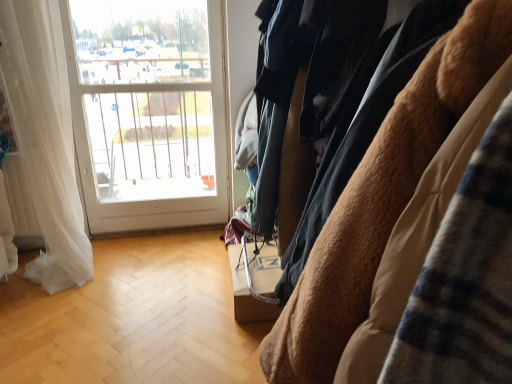
You are a GUI agent. You are given a task and a screenshot of the screen. Output one action in this format:
    pyautogui.click(x=<x>, y=<y>)
    Task: Click on the free space to the right of white sheer curtain at left
    This screenshot has height=384, width=512.
    Given the screenshot: What is the action you would take?
    [131, 258]